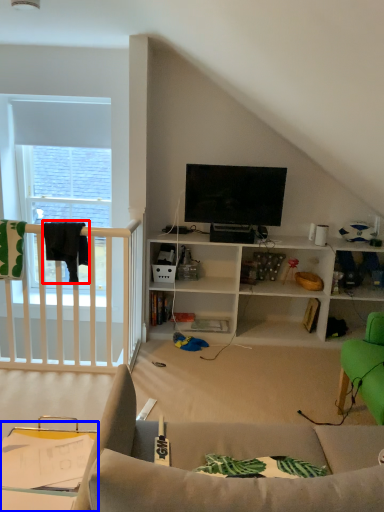
Question: Among these objects, which one is nearest to the camera, clothesline (highlighted by a red box) or table (highlighted by a blue box)?

Choices:
 (A) clothesline
 (B) table

Answer: (B)